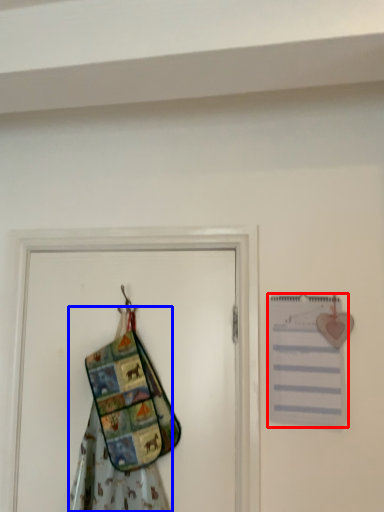
Question: Which point is further to the camera, journal (highlighted by a red box) or fancy dress (highlighted by a blue box)?

Choices:
 (A) journal
 (B) fancy dress

Answer: (A)